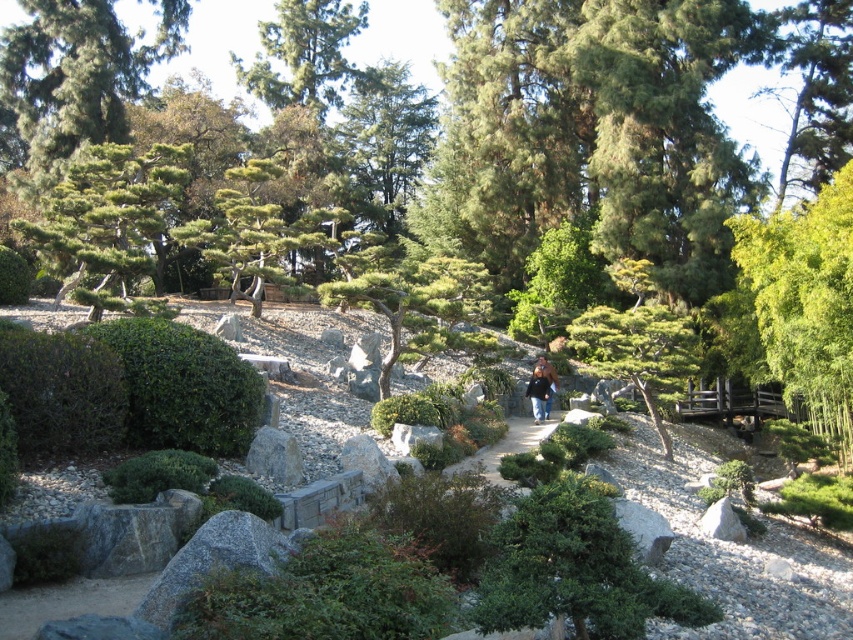
Question: Which object is the farthest from the brown leather jacket at center?

Choices:
 (A) green textured tree at center
 (B) green leafy bush at lower left
 (C) green leafy bush at center

Answer: (B)

Question: Which point appears closest to the camera in this image?

Choices:
 (A) (474, 452)
 (B) (473, 310)
 (C) (788, 332)
 (D) (6, 348)

Answer: (D)

Question: Is green bamboo at right further to camera compared to green textured pine tree at upper left?

Choices:
 (A) yes
 (B) no

Answer: (A)

Question: Is green leafy bush at center further to camera compared to brown leather jacket at center?

Choices:
 (A) no
 (B) yes

Answer: (A)

Question: Which of these objects is positioned farthest from the green textured tree at center?

Choices:
 (A) green textured pine tree at upper left
 (B) green bamboo at right
 (C) green leafy bush at lower left
 (D) green leafy bush at center

Answer: (B)

Question: Considering the relative positions of green leafy bush at center and green textured pine tree at upper left in the image provided, where is green leafy bush at center located with respect to green textured pine tree at upper left?

Choices:
 (A) left
 (B) right

Answer: (B)